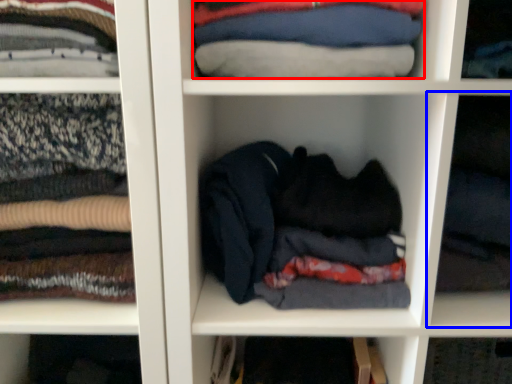
Question: Which object is further to the camera taking this photo, clothing (highlighted by a red box) or cabinet (highlighted by a blue box)?

Choices:
 (A) clothing
 (B) cabinet

Answer: (A)